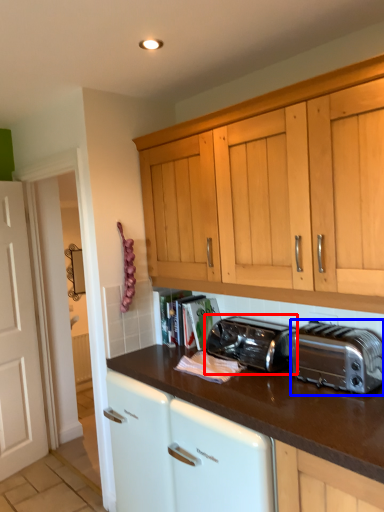
Question: Which point is closer to the camera, toaster (highlighted by a red box) or toaster (highlighted by a blue box)?

Choices:
 (A) toaster
 (B) toaster

Answer: (B)